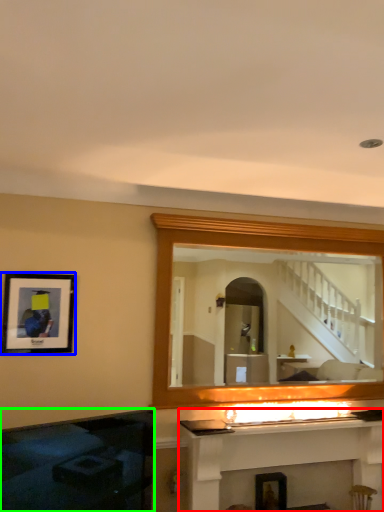
Question: Estimate the real-world distances between objects in this image. Which object is closer to fireplace (highlighted by a red box), picture frame (highlighted by a blue box) or fireplace (highlighted by a green box)?

Choices:
 (A) picture frame
 (B) fireplace

Answer: (B)